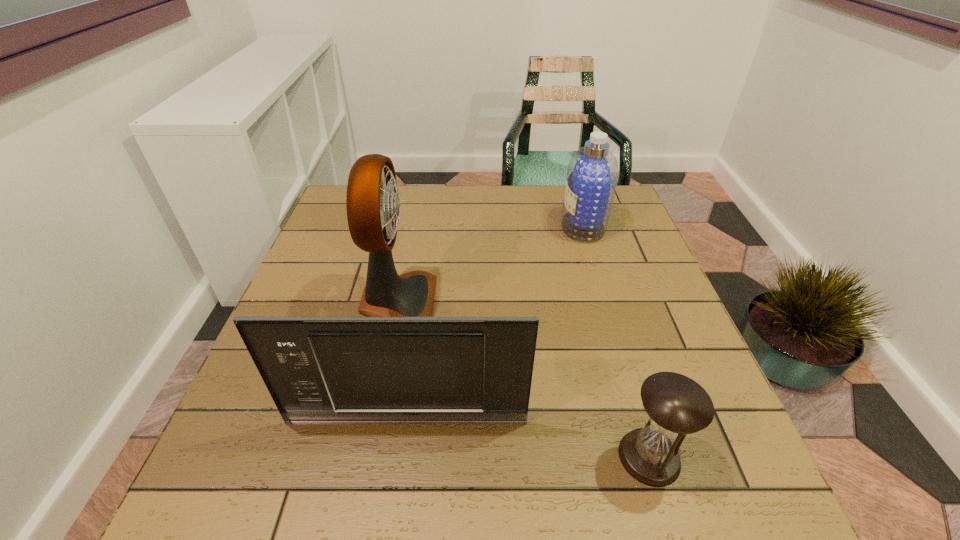
The width and height of the screenshot is (960, 540). Identify the location of fan. (373, 206).

Identify the location of the tallest object. (373, 206).

Image resolution: width=960 pixels, height=540 pixels. Find the location of `cleansing agent`. cleansing agent is located at coordinates (592, 174).

Find the location of `the third farthest object`. the third farthest object is located at coordinates (456, 370).

This screenshot has width=960, height=540. I want to click on the shortest object, so click(x=676, y=405).

Locate an element on the screen. This screenshot has height=540, width=960. hourglass is located at coordinates pos(676,405).

You are a GUI agent. You are given a task and a screenshot of the screen. Output one action in this format:
    pyautogui.click(x=<x>, y=<y>)
    Task: Click on the free space located on the front-facing side of the tallest object
    
    Given the screenshot: What is the action you would take?
    pyautogui.click(x=506, y=301)

At what (x,y) coordinates should I click in order to perform the action: click on vacant space situated 0.090m on the back of the cleansing agent. Please return your answer as a coordinate pair (x, y). The image size is (960, 540). Looking at the image, I should click on (573, 194).

Locate an element on the screen. Image resolution: width=960 pixels, height=540 pixels. blank space located on the front panel of the microwave oven is located at coordinates (400, 462).

You are a GUI agent. You are given a task and a screenshot of the screen. Output one action in this format:
    pyautogui.click(x=<x>, y=<y>)
    Task: Click on the blank space located 0.380m on the left of the shortest object
    The width and height of the screenshot is (960, 540).
    Given the screenshot: What is the action you would take?
    pyautogui.click(x=397, y=457)